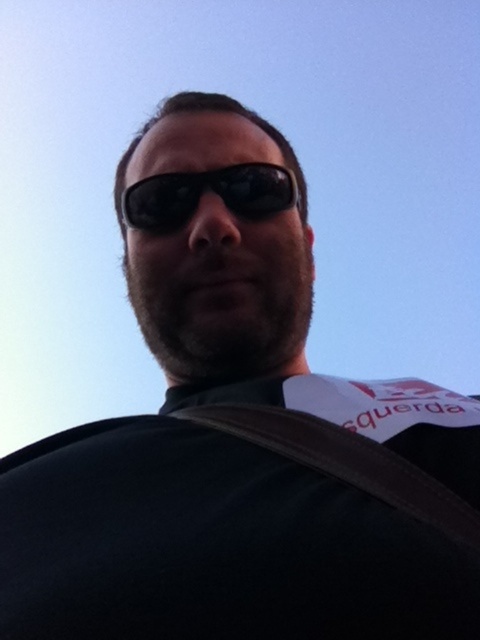
You are trying to determine the position of two points on the image. Given that you are looking at the person in the scene, which point is nearer to you, point (464, 536) or point (136, 182)?

Point (464, 536) is closer to the viewer than point (136, 182) according to the description.

In the scene shown: You are a photographer trying to capture the brown leather strap at lower center and the black reflective sunglasses at center in a single frame. Since the strap is larger than the sunglasses, which object would you need to position closer to the camera to ensure both fit well in the photo?

The brown leather strap at lower center is larger than the black reflective sunglasses at center, so you should position the brown leather strap at lower center closer to the camera to ensure both fit well in the photo.

You are a photographer trying to capture the brown leather strap at lower center and the black reflective sunglasses at center in the same frame. Which object is positioned closer to the camera?

The brown leather strap at lower center is closer to the camera than the black reflective sunglasses at center.